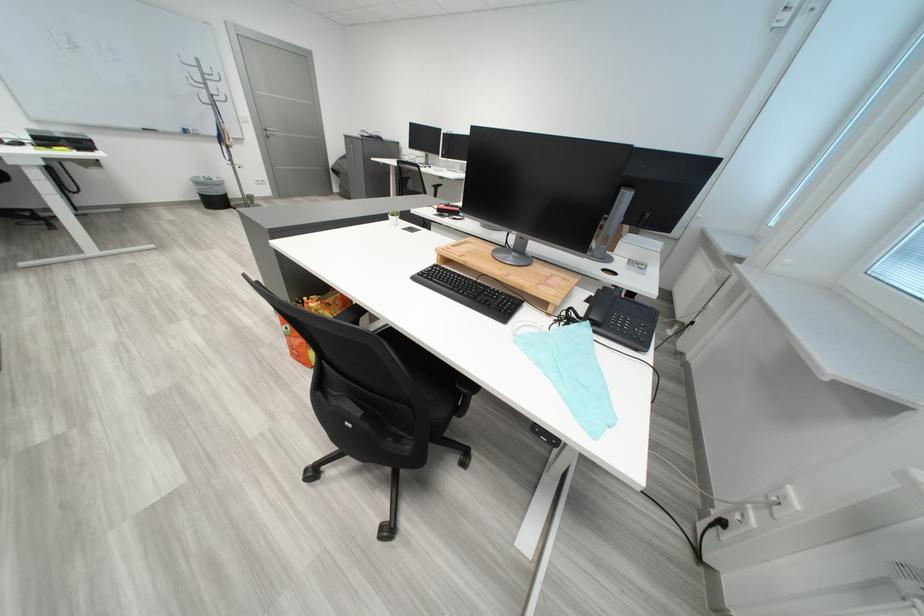
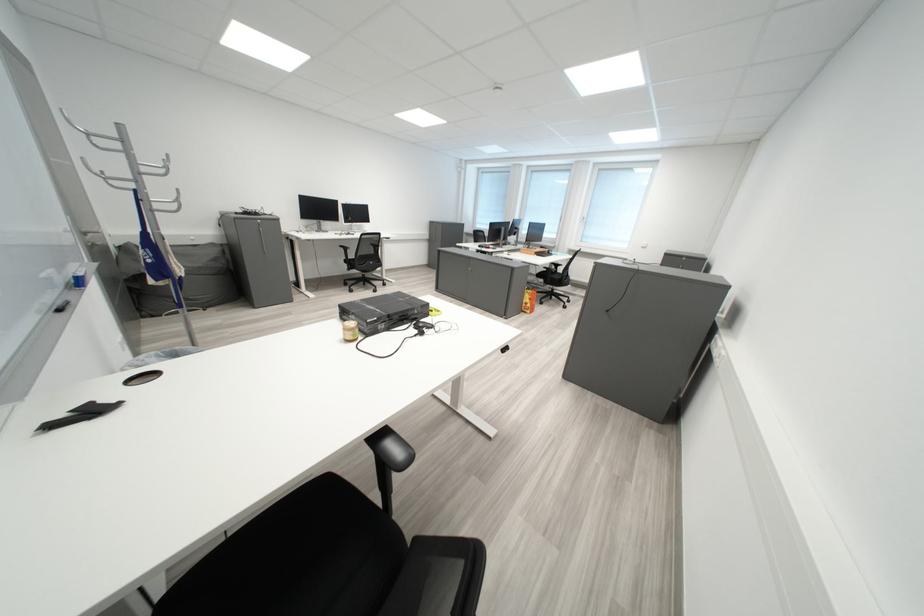
The point at (164, 394) is marked in the first image. Where is the corresponding point in the second image?

(574, 333)